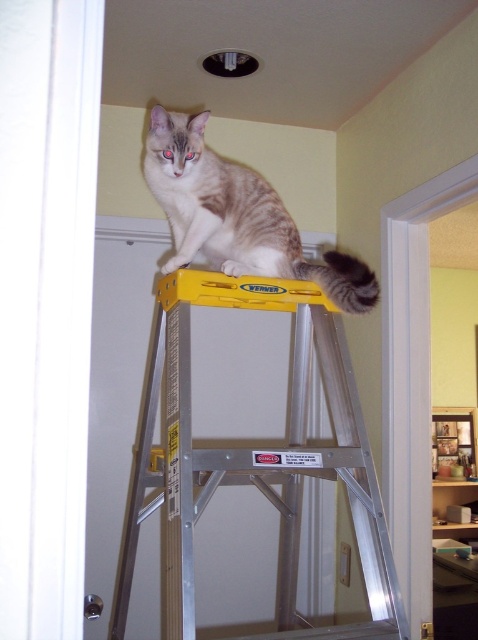
Does yellow metallic ladder at upper center have a larger size compared to tabby fur cat at center?

Indeed, yellow metallic ladder at upper center has a larger size compared to tabby fur cat at center.

The width and height of the screenshot is (478, 640). Describe the element at coordinates (254, 458) in the screenshot. I see `yellow metallic ladder at upper center` at that location.

At what (x,y) coordinates should I click in order to perform the action: click on yellow metallic ladder at upper center. Please return your answer as a coordinate pair (x, y). The width and height of the screenshot is (478, 640). Looking at the image, I should click on (254, 458).

You are a GUI agent. You are given a task and a screenshot of the screen. Output one action in this format:
    pyautogui.click(x=<x>, y=<y>)
    Task: Click on the yellow metallic ladder at upper center
    This screenshot has width=478, height=640.
    Given the screenshot: What is the action you would take?
    pyautogui.click(x=254, y=458)